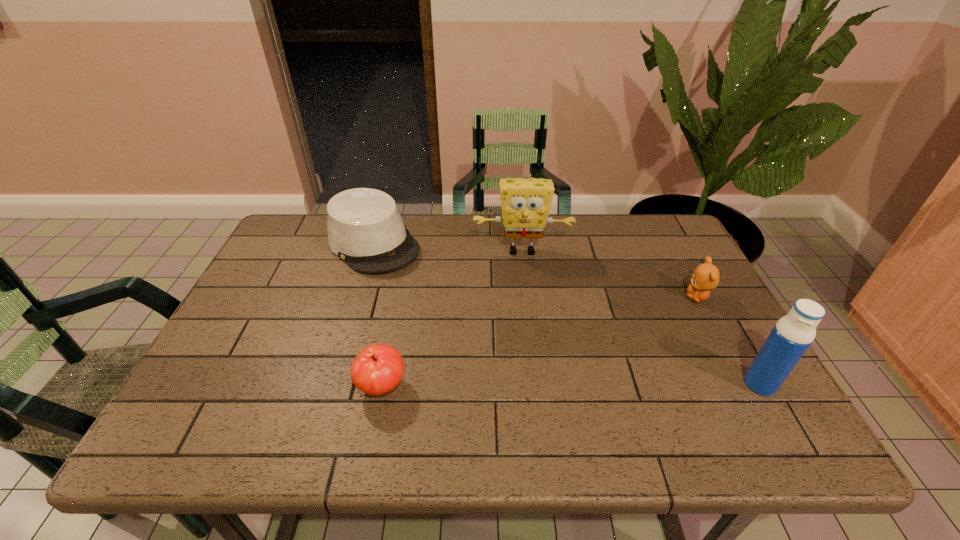
The width and height of the screenshot is (960, 540). Identify the location of free space located 0.240m on the face of the third object from left to right. (526, 321).

The width and height of the screenshot is (960, 540). In order to click on free space located on the face of the third object from left to right in this screenshot , I will do (523, 275).

You are a GUI agent. You are given a task and a screenshot of the screen. Output one action in this format:
    pyautogui.click(x=<x>, y=<y>)
    Task: Click on the free space located on the face of the third object from left to right
    The height and width of the screenshot is (540, 960).
    Given the screenshot: What is the action you would take?
    pyautogui.click(x=523, y=282)

The image size is (960, 540). In order to click on free space located on the front-facing side of the hat in this screenshot , I will do `click(425, 295)`.

Locate an element on the screen. The width and height of the screenshot is (960, 540). vacant space located on the front-facing side of the hat is located at coordinates (421, 291).

Where is `vacant space situated on the front-facing side of the hat`? Image resolution: width=960 pixels, height=540 pixels. vacant space situated on the front-facing side of the hat is located at coordinates (486, 353).

You are a GUI agent. You are given a task and a screenshot of the screen. Output one action in this format:
    pyautogui.click(x=<x>, y=<y>)
    Task: Click on the sponge located in the far edge section of the desktop
    The image size is (960, 540).
    Given the screenshot: What is the action you would take?
    pyautogui.click(x=525, y=203)

The width and height of the screenshot is (960, 540). I want to click on hat that is at the far edge, so click(365, 229).

Locate an element on the screen. The width and height of the screenshot is (960, 540). apple situated at the near edge is located at coordinates (377, 369).

Where is `water bottle located at the near edge`? This screenshot has height=540, width=960. water bottle located at the near edge is located at coordinates (792, 335).